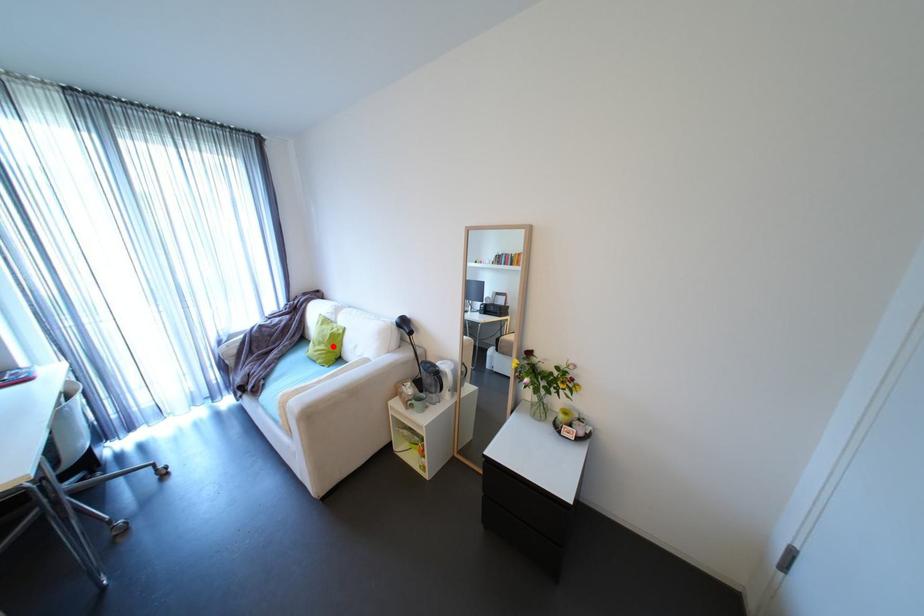
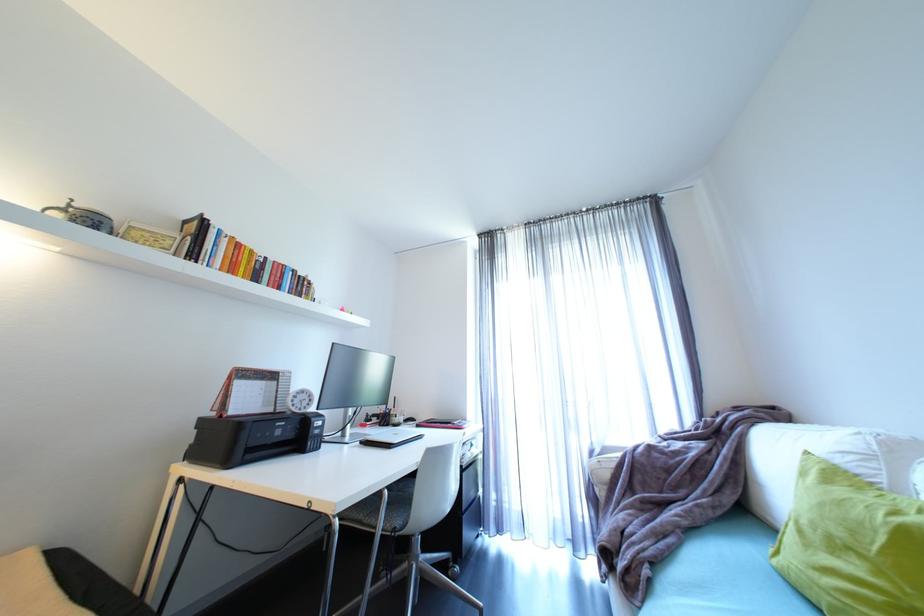
Question: I am providing you with two images of the same scene from different viewpoints. Given a red point in image1, look at the same physical point in image2. Is it:

Choices:
 (A) Closer to the viewpoint
 (B) Farther from the viewpoint

Answer: (A)